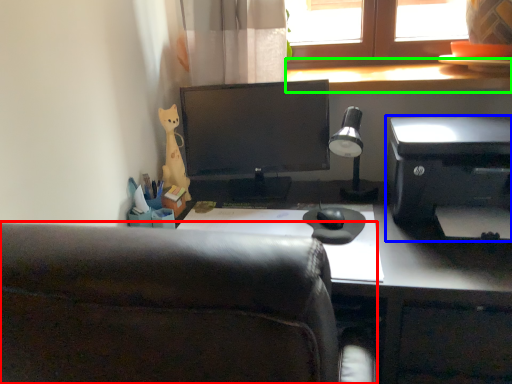
Question: Estimate the real-world distances between objects in this image. Which object is closer to chair (highlighted by a red box), printer (highlighted by a blue box) or window sill (highlighted by a green box)?

Choices:
 (A) printer
 (B) window sill

Answer: (A)